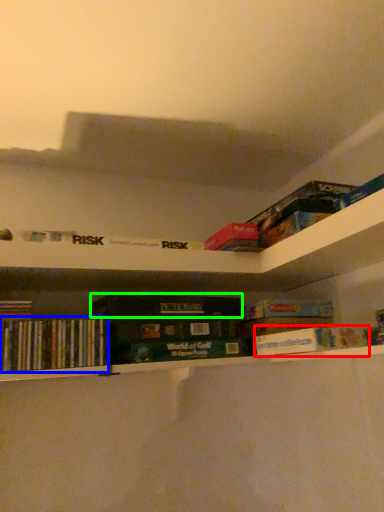
Question: Which object is the farthest from book (highlighted by a red box)? Choose among these: book (highlighted by a blue box) or paperback book (highlighted by a green box).

Choices:
 (A) book
 (B) paperback book

Answer: (A)